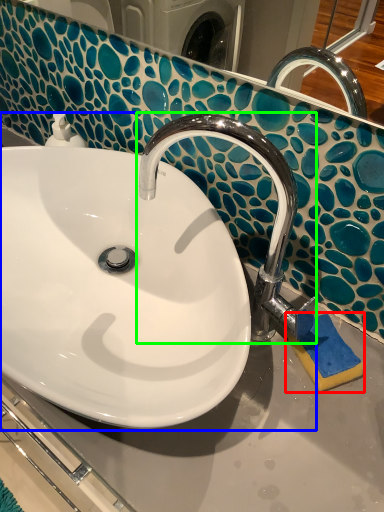
Question: Which object is the closest to the soap (highlighted by a red box)? Choose among these: sink (highlighted by a blue box) or tap (highlighted by a green box).

Choices:
 (A) sink
 (B) tap

Answer: (B)